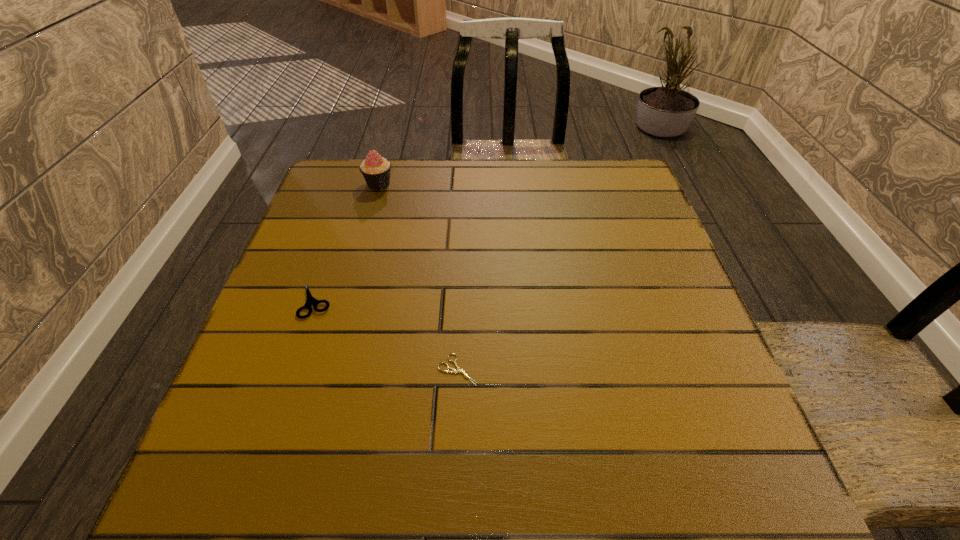
Image resolution: width=960 pixels, height=540 pixels. Find the location of `cupcake located in the left edge section of the desktop`. cupcake located in the left edge section of the desktop is located at coordinates (376, 170).

What are the coordinates of `shears positioned at the left edge` in the screenshot? It's located at coord(310,300).

Identify the location of object positioned at the far left corner. This screenshot has height=540, width=960. (376, 170).

This screenshot has width=960, height=540. I want to click on vacant space at the far edge of the desktop, so click(505, 164).

Locate an element on the screen. Image resolution: width=960 pixels, height=540 pixels. vacant area at the near edge is located at coordinates (468, 507).

The image size is (960, 540). What are the coordinates of `vacant space at the left edge` in the screenshot? It's located at (337, 295).

Where is `blank space at the right edge of the desktop`? Image resolution: width=960 pixels, height=540 pixels. blank space at the right edge of the desktop is located at coordinates (638, 368).

Where is `free space between the shortest object and the farthest object`? This screenshot has height=540, width=960. free space between the shortest object and the farthest object is located at coordinates (419, 277).

Locate an element on the screen. The height and width of the screenshot is (540, 960). unoccupied position between the farthest object and the nearest object is located at coordinates (419, 277).

Where is `free space between the shorter shears and the tallest object`? free space between the shorter shears and the tallest object is located at coordinates (419, 277).